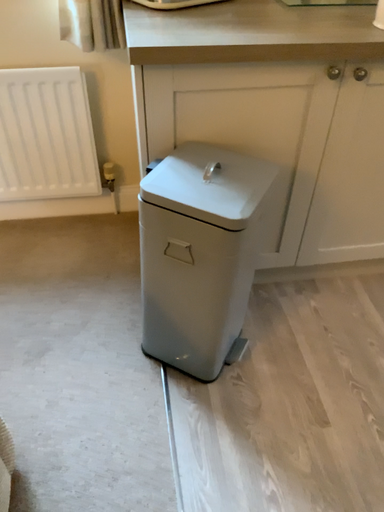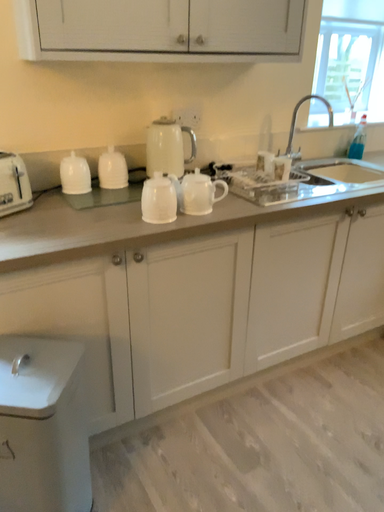
Question: Which way did the camera rotate in the video?

Choices:
 (A) rotated right
 (B) rotated left

Answer: (A)